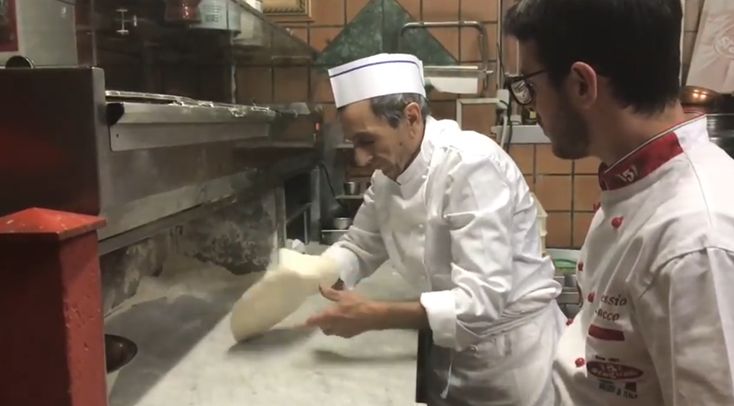
You are a GUI agent. You are given a task and a screenshot of the screen. Output one action in this format:
    pyautogui.click(x=<x>, y=<y>)
    Task: Click on the tiled walls
    The height and width of the screenshot is (406, 734).
    Given the screenshot: What is the action you would take?
    pyautogui.click(x=323, y=18), pyautogui.click(x=555, y=186)